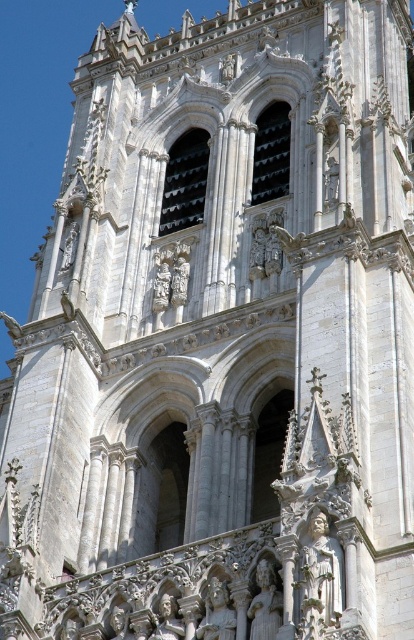
You are a maintenance worker who needs to clean both the polished stone statue at center and the polished silver statue at center. The cleaning equipment you have can only reach 1 meter. Can you clean both statues without moving the equipment?

The polished stone statue at center is 1.22 meters away from the polished silver statue at center. Since the equipment can only reach 1 meter, you will need to move the equipment to reach both statues.

You are standing at the base of the Gothic tower and notice a point marked at coordinates [319,579]. Can you identify what this point corresponds to in the scene?

The point at [319,579] corresponds to the white stone statue at lower center.

You are standing at the base of the grand Gothic tower. You want to locate the white stone statue at center. Where should you look relative to the tower?

The white stone statue at center is located at point (264, 604) on the tower, which means it is positioned approximately 94.4 percent from the left edge and 64 percent from the bottom edge of the tower structure.